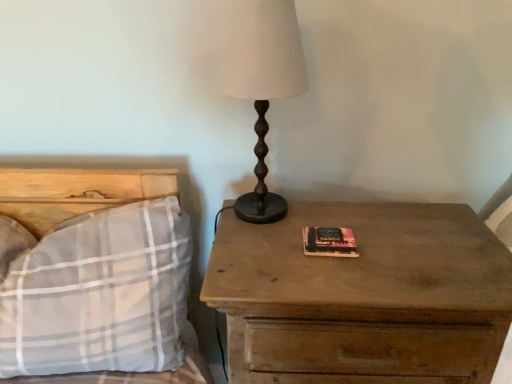
You are a GUI agent. You are given a task and a screenshot of the screen. Output one action in this format:
    pyautogui.click(x=<x>, y=<y>)
    Task: Click on the free region under matte brown table lamp at center (from a real-world perspective)
    
    Given the screenshot: What is the action you would take?
    pyautogui.click(x=268, y=216)